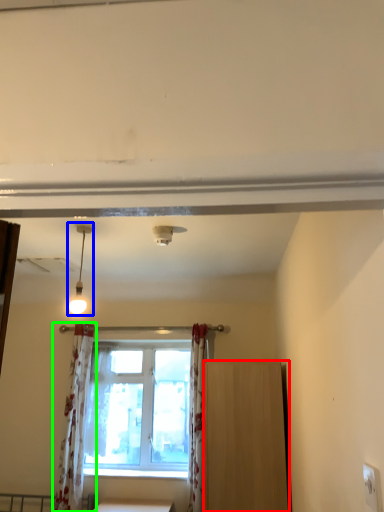
Question: Considering the real-world distances, which object is farthest from furniture (highlighted by a red box)? light fixture (highlighted by a blue box) or curtain (highlighted by a green box)?

Choices:
 (A) light fixture
 (B) curtain

Answer: (B)